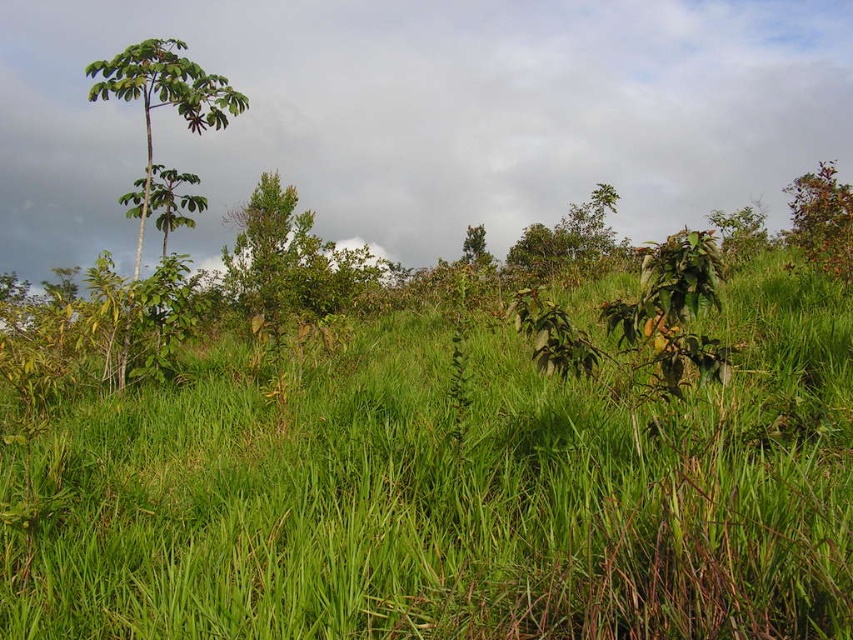
You are standing in the lush landscape and want to know which area takes up more space between the green grassy at center and the green leafy tree at left. Can you determine which one is larger in size?

The green leafy tree at left occupies more space than the green grassy at center, so the green leafy tree at left is larger in size.

You are standing in the lush landscape and want to find a clear view of the sky. Which object, the green leafy tree at left or the green leafy shrub at upper right, is positioned higher and might block your view?

The green leafy tree at left is above the green leafy shrub at upper right, so it is positioned higher and might block your view.

You are standing in the lush green landscape and want to walk from the point at coordinates (x=172, y=61) to the point at (x=849, y=211). Which direction should you face to move towards the second point?

Since point (x=172, y=61) is closer to the viewer than point (x=849, y=211), you should face away from the direction of the foreground vegetation towards the background to reach the second point.